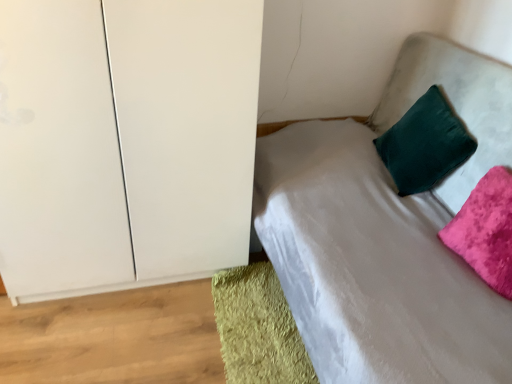
At what (x,y) coordinates should I click in order to perform the action: click on velvet pink pillow at upper right, the 2th pillow viewed from the back. Please return your answer as a coordinate pair (x, y). Looking at the image, I should click on (486, 230).

Describe the element at coordinates (388, 234) in the screenshot. I see `velvet green pillow at upper right` at that location.

Find the location of `velvet green pillow at upper right, the second pillow positioned from the front`. velvet green pillow at upper right, the second pillow positioned from the front is located at coordinates (425, 144).

From the image's perspective, does velvet green pillow at upper right appear lower than velvet pink pillow at upper right, arranged as the first pillow when viewed from the front?

No, from the image's perspective, velvet green pillow at upper right is not below velvet pink pillow at upper right, arranged as the first pillow when viewed from the front.

From a real-world perspective, is velvet green pillow at upper right below velvet pink pillow at upper right, arranged as the first pillow when viewed from the front?

Correct, in the physical world, velvet green pillow at upper right is lower than velvet pink pillow at upper right, arranged as the first pillow when viewed from the front.

Is velvet green pillow at upper right positioned far away from velvet pink pillow at upper right, the 2th pillow viewed from the back?

No, velvet green pillow at upper right is not far away from velvet pink pillow at upper right, the 2th pillow viewed from the back.

Based on the photo, which object is positioned more to the right, velvet green pillow at upper right or velvet pink pillow at upper right, the 2th pillow viewed from the back?

velvet pink pillow at upper right, the 2th pillow viewed from the back.

From the image's perspective, would you say green shaggy rug at lower left is positioned over velvet pink pillow at upper right, arranged as the first pillow when viewed from the front?

Incorrect, from the image's perspective, green shaggy rug at lower left is lower than velvet pink pillow at upper right, arranged as the first pillow when viewed from the front.

Is green shaggy rug at lower left with velvet pink pillow at upper right, the 2th pillow viewed from the back?

No.

Who is smaller, green shaggy rug at lower left or velvet pink pillow at upper right, arranged as the first pillow when viewed from the front?

green shaggy rug at lower left is smaller.

Measure the distance between velvet green pillow at upper right, the second pillow positioned from the front, and green shaggy rug at lower left.

They are 34.46 inches apart.

From a real-world perspective, count 2nd pillows upward from the green shaggy rug at lower left and point to it. Please provide its 2D coordinates.

[(425, 144)]

Which object is closer to the camera taking this photo, velvet green pillow at upper right, the second pillow positioned from the front, or green shaggy rug at lower left?

green shaggy rug at lower left is more forward.

Is point (414, 135) closer or farther from the camera than point (221, 302)?

Point (414, 135).

Considering the positions of points (17, 195) and (447, 238), is point (17, 195) closer to camera compared to point (447, 238)?

Yes, point (17, 195) is closer to viewer.

Can you confirm if white matte cabinet at left is bigger than velvet pink pillow at upper right, the 2th pillow viewed from the back?

Indeed, white matte cabinet at left has a larger size compared to velvet pink pillow at upper right, the 2th pillow viewed from the back.

From a real-world perspective, relative to velvet pink pillow at upper right, arranged as the first pillow when viewed from the front, is white matte cabinet at left vertically above or below?

From a real-world perspective, white matte cabinet at left is physically above velvet pink pillow at upper right, arranged as the first pillow when viewed from the front.

Is velvet pink pillow at upper right, arranged as the first pillow when viewed from the front, at the back of white matte cabinet at left?

white matte cabinet at left does not have its back to velvet pink pillow at upper right, arranged as the first pillow when viewed from the front.

Could you measure the distance between white matte cabinet at left and velvet green pillow at upper right, placed as the 1th pillow when sorted from back to front?

They are 3.38 feet apart.

Considering the sizes of objects white matte cabinet at left and velvet green pillow at upper right, placed as the 1th pillow when sorted from back to front, in the image provided, who is smaller, white matte cabinet at left or velvet green pillow at upper right, placed as the 1th pillow when sorted from back to front,?

velvet green pillow at upper right, placed as the 1th pillow when sorted from back to front.

From the image's perspective, between white matte cabinet at left and velvet green pillow at upper right, placed as the 1th pillow when sorted from back to front, which one is located above?

velvet green pillow at upper right, placed as the 1th pillow when sorted from back to front, is shown above in the image.

Which object is further away from the camera taking this photo, white matte cabinet at left or velvet green pillow at upper right, placed as the 1th pillow when sorted from back to front?

velvet green pillow at upper right, placed as the 1th pillow when sorted from back to front, is further from the camera.

Between green shaggy rug at lower left and velvet green pillow at upper right, which one has smaller width?

green shaggy rug at lower left.

The height and width of the screenshot is (384, 512). In order to click on material behind the velvet green pillow at upper right in this screenshot , I will do `click(258, 328)`.

Considering the positions of objects green shaggy rug at lower left and velvet green pillow at upper right in the image provided, who is in front, green shaggy rug at lower left or velvet green pillow at upper right?

Positioned in front is velvet green pillow at upper right.

From the image's perspective, is green shaggy rug at lower left located above velvet green pillow at upper right?

Incorrect, from the image's perspective, green shaggy rug at lower left is lower than velvet green pillow at upper right.

Is velvet green pillow at upper right beside velvet green pillow at upper right, the second pillow positioned from the front?

velvet green pillow at upper right and velvet green pillow at upper right, the second pillow positioned from the front, are clearly separated.

From the picture: Can we say velvet green pillow at upper right lies outside velvet green pillow at upper right, placed as the 1th pillow when sorted from back to front?

velvet green pillow at upper right lies outside velvet green pillow at upper right, placed as the 1th pillow when sorted from back to front,'s area.

Can you confirm if velvet green pillow at upper right is wider than velvet green pillow at upper right, the second pillow positioned from the front?

Indeed, velvet green pillow at upper right has a greater width compared to velvet green pillow at upper right, the second pillow positioned from the front.

Does point (504, 144) appear closer or farther from the camera than point (426, 163)?

Point (504, 144) is closer to the camera than point (426, 163).

Where is `pillow that is the 2nd object to the right of the velvet green pillow at upper right, starting at the anchor`? pillow that is the 2nd object to the right of the velvet green pillow at upper right, starting at the anchor is located at coordinates (486, 230).

This screenshot has width=512, height=384. Find the location of `the 1st pillow located above the green shaggy rug at lower left (from a real-world perspective)`. the 1st pillow located above the green shaggy rug at lower left (from a real-world perspective) is located at coordinates (486, 230).

Estimate the real-world distances between objects in this image. Which object is closer to white matte cabinet at left, velvet pink pillow at upper right, arranged as the first pillow when viewed from the front, or velvet green pillow at upper right, placed as the 1th pillow when sorted from back to front?

Based on the image, velvet green pillow at upper right, placed as the 1th pillow when sorted from back to front, appears to be nearer to white matte cabinet at left.

Considering their positions, is velvet pink pillow at upper right, arranged as the first pillow when viewed from the front, positioned closer to velvet green pillow at upper right, placed as the 1th pillow when sorted from back to front, than white matte cabinet at left?

velvet pink pillow at upper right, arranged as the first pillow when viewed from the front, is positioned closer to the anchor velvet green pillow at upper right, placed as the 1th pillow when sorted from back to front.

From the image, which object appears to be farther from white matte cabinet at left, velvet green pillow at upper right or velvet green pillow at upper right, the second pillow positioned from the front?

velvet green pillow at upper right, the second pillow positioned from the front, is further to white matte cabinet at left.

From the image, which object appears to be farther from green shaggy rug at lower left, white matte cabinet at left or velvet green pillow at upper right?

Among the two, white matte cabinet at left is located further to green shaggy rug at lower left.

Estimate the real-world distances between objects in this image. Which object is closer to white matte cabinet at left, velvet green pillow at upper right, placed as the 1th pillow when sorted from back to front, or velvet green pillow at upper right?

velvet green pillow at upper right lies closer to white matte cabinet at left than the other object.

Considering their positions, is green shaggy rug at lower left positioned closer to velvet pink pillow at upper right, arranged as the first pillow when viewed from the front, than velvet green pillow at upper right, placed as the 1th pillow when sorted from back to front?

velvet green pillow at upper right, placed as the 1th pillow when sorted from back to front, is positioned closer to the anchor velvet pink pillow at upper right, arranged as the first pillow when viewed from the front.

Estimate the real-world distances between objects in this image. Which object is further from velvet green pillow at upper right, the second pillow positioned from the front, white matte cabinet at left or green shaggy rug at lower left?

white matte cabinet at left is further to velvet green pillow at upper right, the second pillow positioned from the front.

Looking at the image, which one is located closer to velvet pink pillow at upper right, arranged as the first pillow when viewed from the front, velvet green pillow at upper right, the second pillow positioned from the front, or velvet green pillow at upper right?

velvet green pillow at upper right lies closer to velvet pink pillow at upper right, arranged as the first pillow when viewed from the front, than the other object.

Locate an element on the screen. This screenshot has width=512, height=384. pillow situated between white matte cabinet at left and velvet pink pillow at upper right, the 2th pillow viewed from the back, from left to right is located at coordinates (425, 144).

Locate an element on the screen. This screenshot has height=384, width=512. pillow located between green shaggy rug at lower left and velvet pink pillow at upper right, arranged as the first pillow when viewed from the front, in the left-right direction is located at coordinates (425, 144).

Identify the location of material located between white matte cabinet at left and velvet green pillow at upper right in the left-right direction. Image resolution: width=512 pixels, height=384 pixels. (x=258, y=328).

Image resolution: width=512 pixels, height=384 pixels. In order to click on bed between white matte cabinet at left and velvet green pillow at upper right, the second pillow positioned from the front, in the horizontal direction in this screenshot , I will do `click(388, 234)`.